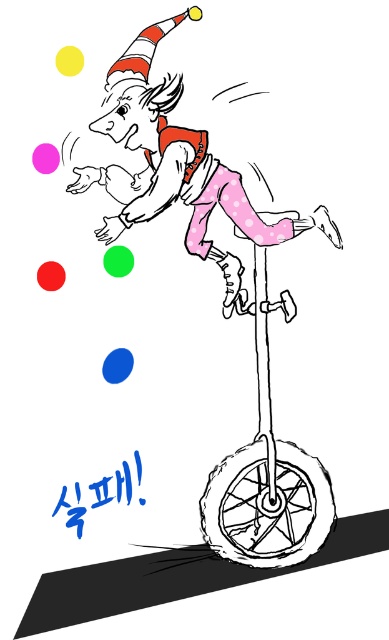
You are a delivery robot that is 6 inches wide. You need to pass between the pink dotted pants at center and the black rubber scooter at center. Can you fit through the space between them?

The distance between the pink dotted pants at center and the black rubber scooter at center is 7.36 inches, so yes, the robot can fit through the space since it is wider than the robot.

You are a delivery robot that needs to move from the black rubber scooter at center to the black rubber wheel at lower center. Can you safely navigate the 0.81 inches gap between them?

The black rubber scooter at center and black rubber wheel at lower center are 0.81 inches apart, so yes, the delivery robot can safely navigate the gap between them since it is wide enough for the robot to move through.

You are a photographer trying to capture the clown in the center. You need to ensure that both the pink dotted pants at center and the black rubber scooter at center are visible in the frame. Based on their positions, which object should you place on the left side of your camera frame to include both?

The pink dotted pants at center is positioned on the left side of black rubber scooter at center, so you should place the pink dotted pants at center on the left side of the camera frame to include both objects.